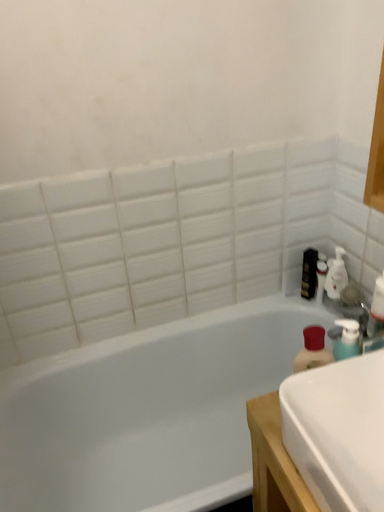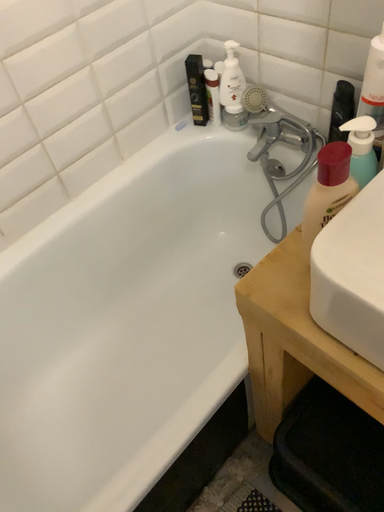
Question: Which way did the camera rotate in the video?

Choices:
 (A) rotated downward
 (B) rotated upward

Answer: (A)